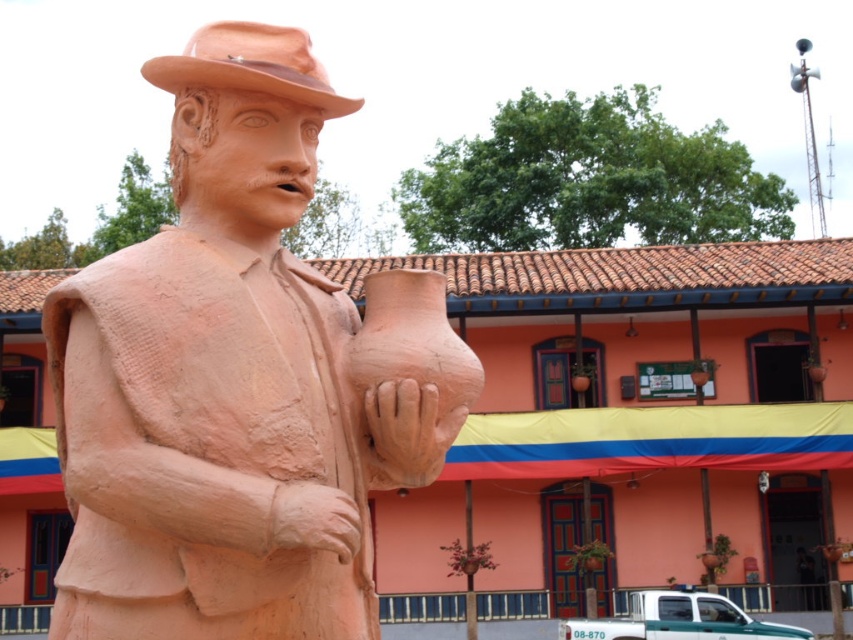
Is matte clay statue at center further to camera compared to matte clay fedora at upper center?

No, it is not.

Is matte clay statue at center below matte clay fedora at upper center?

Indeed, matte clay statue at center is positioned under matte clay fedora at upper center.

The width and height of the screenshot is (853, 640). Describe the element at coordinates (227, 384) in the screenshot. I see `matte clay statue at center` at that location.

Locate an element on the screen. The image size is (853, 640). matte clay statue at center is located at coordinates 227,384.